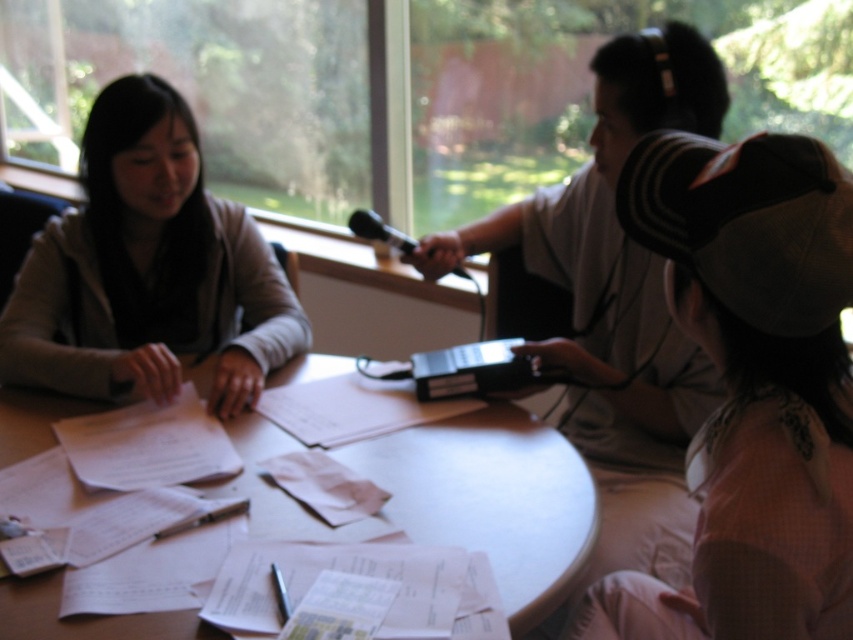
Does light brown sweater at left come behind white wooden table at center?

That is True.

Between light brown sweater at left and white wooden table at center, which one is positioned lower?

Positioned lower is white wooden table at center.

Image resolution: width=853 pixels, height=640 pixels. Find the location of `light brown sweater at left`. light brown sweater at left is located at coordinates (148, 269).

Does white mesh cap at lower right appear over white paper at center?

Indeed, white mesh cap at lower right is positioned over white paper at center.

Who is positioned more to the right, white mesh cap at lower right or white paper at center?

white mesh cap at lower right is more to the right.

Find the location of `white mesh cap at lower right`. white mesh cap at lower right is located at coordinates (751, 388).

Who is more forward, (99, 214) or (196, 481)?

Positioned in front is point (196, 481).

Is point (202, 221) in front of point (91, 483)?

No, (202, 221) is further to viewer.

Is point (149, 180) less distant than point (149, 429)?

No, it is behind (149, 429).

You are a GUI agent. You are given a task and a screenshot of the screen. Output one action in this format:
    pyautogui.click(x=<x>, y=<y>)
    Task: Click on the light brown sweater at left
    The image size is (853, 640).
    Given the screenshot: What is the action you would take?
    pyautogui.click(x=148, y=269)